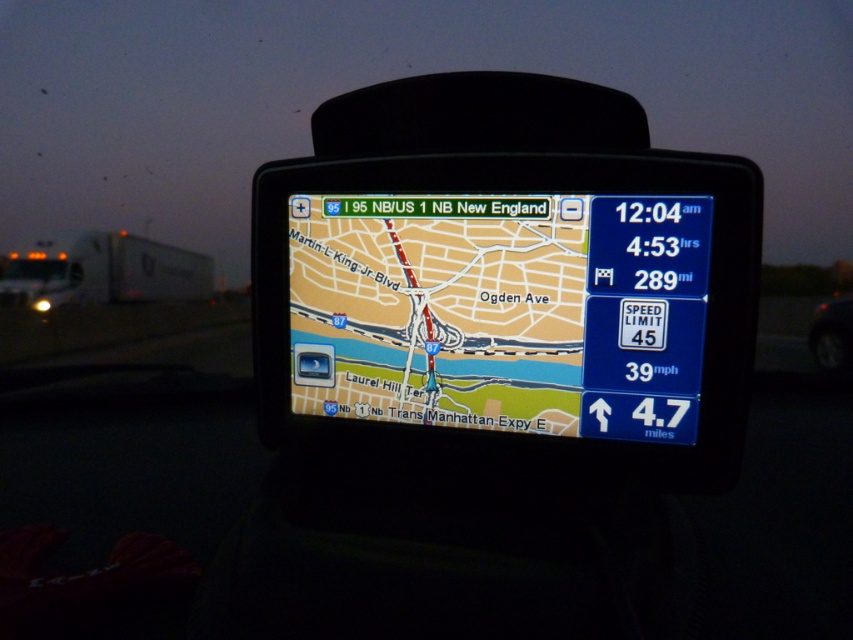
Does point (584, 280) come behind point (851, 330)?

No.

Does beige paper map at center appear under shiny black tire at lower right?

Incorrect, beige paper map at center is not positioned below shiny black tire at lower right.

In order to click on beige paper map at center in this screenshot , I will do `click(502, 310)`.